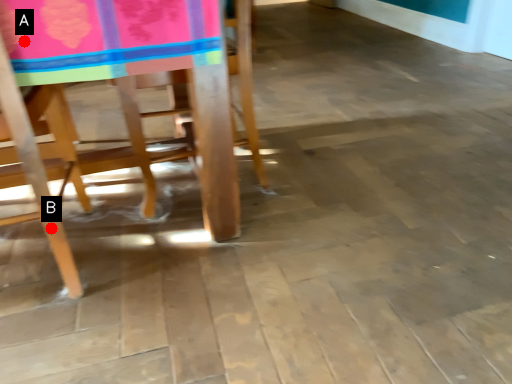
Question: Two points are circled on the image, labeled by A and B beside each circle. Which point is farther to the camera?

Choices:
 (A) A is further
 (B) B is further

Answer: (B)